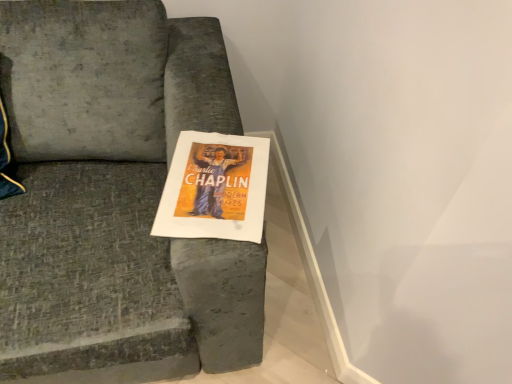
Where is `free spot above matte paper poster at center (from a real-world perspective)`? The image size is (512, 384). free spot above matte paper poster at center (from a real-world perspective) is located at coordinates (214, 182).